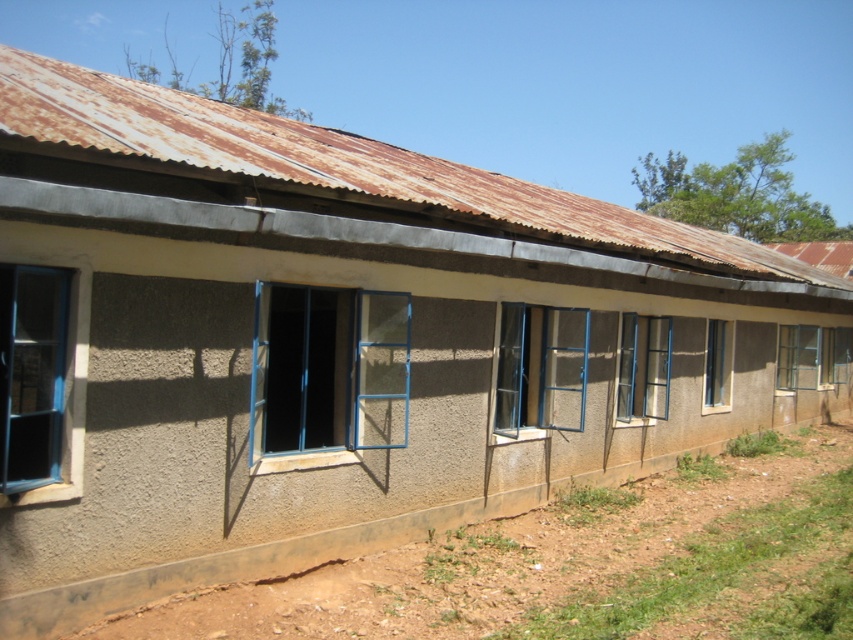
Is point (630, 371) closer to viewer compared to point (788, 353)?

That is True.

Is matte blue glass window at center further to camera compared to clear glass window at center right?

That is False.

The height and width of the screenshot is (640, 853). Find the location of `matte blue glass window at center`. matte blue glass window at center is located at coordinates (643, 368).

Can you confirm if clear glass window at center right is positioned to the right of clear glass window at center?

Correct, you'll find clear glass window at center right to the right of clear glass window at center.

Does clear glass window at center right have a larger size compared to clear glass window at center?

Yes, clear glass window at center right is bigger than clear glass window at center.

Which is behind, point (831, 332) or point (722, 392)?

Positioned behind is point (831, 332).

You are a GUI agent. You are given a task and a screenshot of the screen. Output one action in this format:
    pyautogui.click(x=<x>, y=<y>)
    Task: Click on the clear glass window at center right
    This screenshot has width=853, height=640.
    Given the screenshot: What is the action you would take?
    pyautogui.click(x=811, y=356)

Does metallic blue window at center appear on the left side of clear glass window at center?

Indeed, metallic blue window at center is positioned on the left side of clear glass window at center.

How far apart are metallic blue window at center and clear glass window at center?

metallic blue window at center is 4.40 meters from clear glass window at center.

The height and width of the screenshot is (640, 853). Find the location of `metallic blue window at center`. metallic blue window at center is located at coordinates (540, 369).

Locate an element on the screen. This screenshot has height=640, width=853. metallic blue window at center is located at coordinates (540, 369).